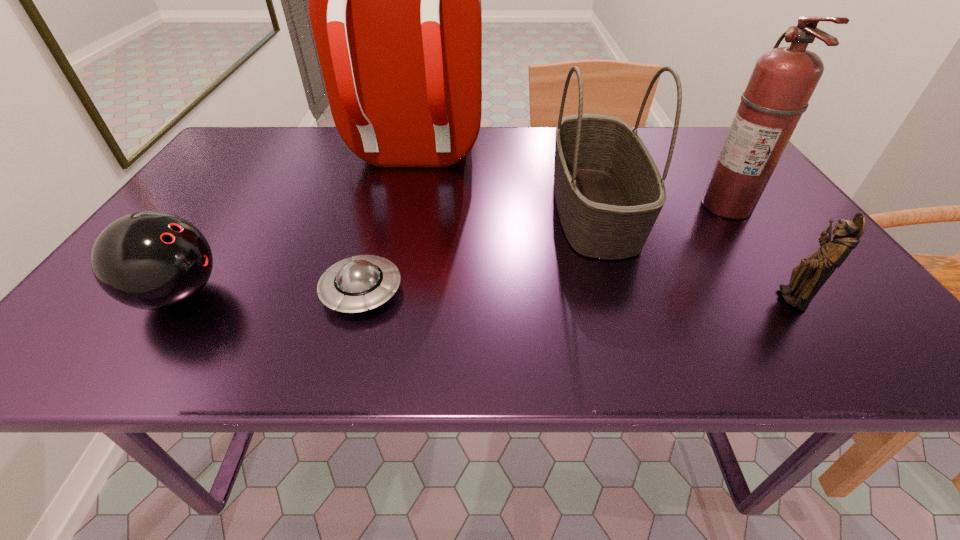
Find the location of a particular element. The image size is (960, 540). vacant space that is in between the saucer and the second tallest object is located at coordinates (544, 249).

The height and width of the screenshot is (540, 960). In order to click on free space between the leftmost object and the figurine in this screenshot , I will do `click(485, 296)`.

Locate an element on the screen. The height and width of the screenshot is (540, 960). vacant space in between the leftmost object and the basket is located at coordinates (386, 252).

At what (x,y) coordinates should I click in order to perform the action: click on empty space between the third tallest object and the leftmost object. Please return your answer as a coordinate pair (x, y). Looking at the image, I should click on (386, 252).

Identify the location of free space between the figurine and the bowling ball. The height and width of the screenshot is (540, 960). (485, 296).

The image size is (960, 540). What are the coordinates of `vacant point located between the figurine and the basket` in the screenshot? It's located at (692, 253).

Find the location of a particular element. vacant point located between the bowling ball and the figurine is located at coordinates (485, 296).

The height and width of the screenshot is (540, 960). Find the location of `blank region between the fire extinguisher and the shortest object`. blank region between the fire extinguisher and the shortest object is located at coordinates (544, 249).

You are a GUI agent. You are given a task and a screenshot of the screen. Output one action in this format:
    pyautogui.click(x=<x>, y=<y>)
    Task: Click on the empty location between the tallest object and the fourth object from left to right
    This screenshot has width=960, height=540.
    Given the screenshot: What is the action you would take?
    pyautogui.click(x=503, y=183)

Select which object appears as the fifth closest to the figurine. Please provide its 2D coordinates. Your answer should be formatted as a tuple, i.e. [(x, y)], where the tuple contains the x and y coordinates of a point satisfying the conditions above.

[(150, 260)]